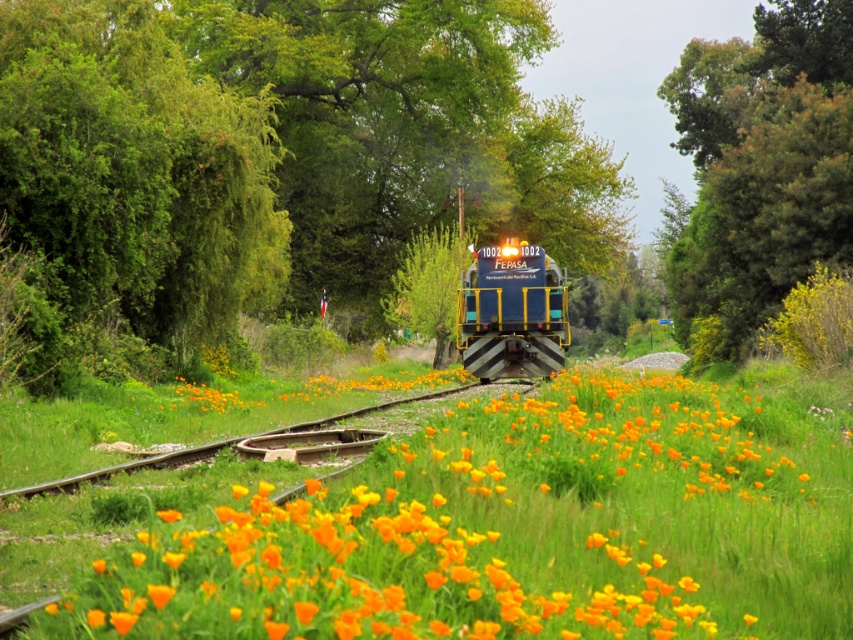
Does green leafy tree at center come in front of green leafy tree at upper right?

Yes, it is in front of green leafy tree at upper right.

Which is behind, point (140, 141) or point (815, 81)?

The point (815, 81) is more distant.

You are a GUI agent. You are given a task and a screenshot of the screen. Output one action in this format:
    pyautogui.click(x=<x>, y=<y>)
    Task: Click on the green leafy tree at center
    The width and height of the screenshot is (853, 640).
    Given the screenshot: What is the action you would take?
    pyautogui.click(x=274, y=156)

Where is `green leafy tree at center`? green leafy tree at center is located at coordinates (274, 156).

Between point (786, 156) and point (370, 380), which one is positioned behind?

The point (786, 156) is more distant.

Can you confirm if green leafy tree at upper right is taller than orange matte flower at center?

Yes, green leafy tree at upper right is taller than orange matte flower at center.

Who is more forward, (689, 246) or (200, 388)?

Point (200, 388) is in front.

You are a GUI agent. You are given a task and a screenshot of the screen. Output one action in this format:
    pyautogui.click(x=<x>, y=<y>)
    Task: Click on the green leafy tree at upper right
    The height and width of the screenshot is (640, 853).
    Given the screenshot: What is the action you would take?
    pyautogui.click(x=762, y=164)

Between green leafy tree at upper right and blue metallic train at center, which one is positioned higher?

green leafy tree at upper right

Between green leafy tree at upper right and blue metallic train at center, which one is positioned lower?

blue metallic train at center is below.

Is point (671, 97) positioned in front of point (531, 305)?

No, it is not.

Image resolution: width=853 pixels, height=640 pixels. In order to click on green leafy tree at upper right in this screenshot , I will do `click(762, 164)`.